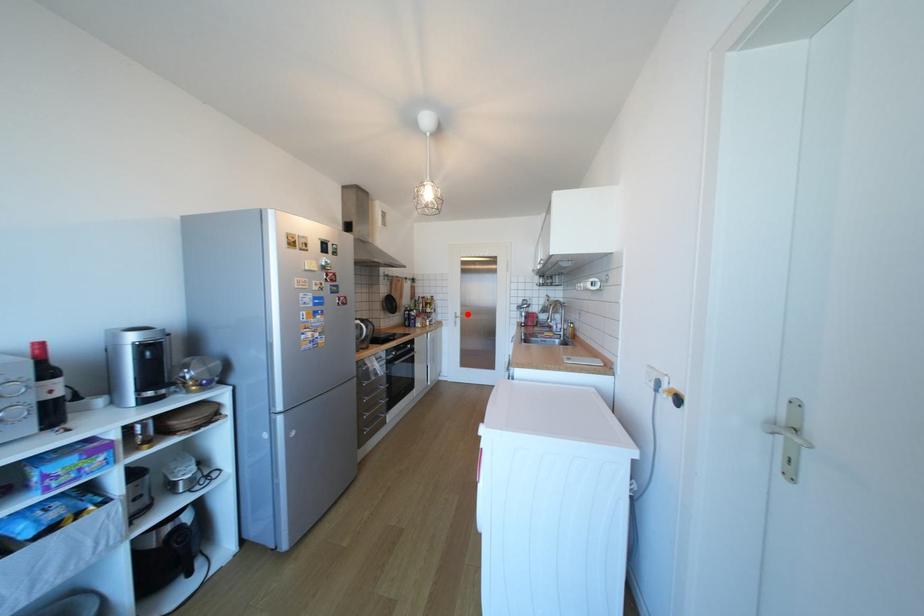
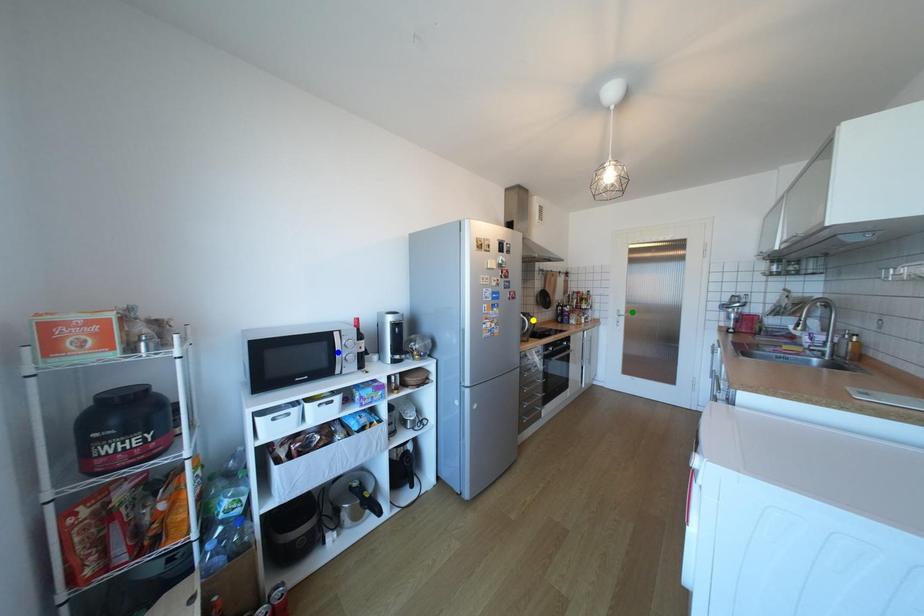
Question: I am providing you with two images of the same scene from different viewpoints. A red point is marked on the first image. You are given multiple points on the second image. Which point in image 2 represents the same 3d spot as the red point in image 1?

Choices:
 (A) blue point
 (B) yellow point
 (C) green point

Answer: (C)